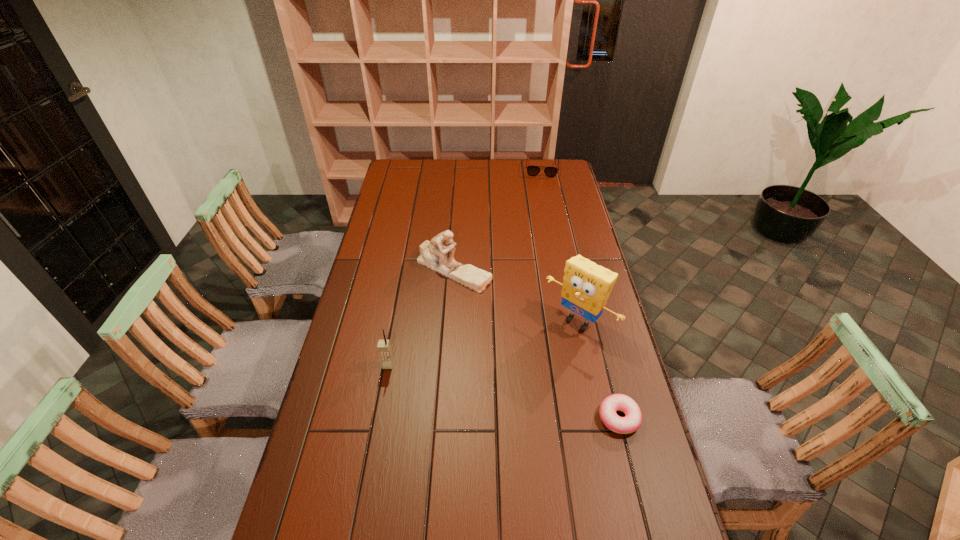
This screenshot has width=960, height=540. Identify the location of free space located on the face of the tallest object. (493, 408).

Locate an element on the screen. object at the far edge is located at coordinates (531, 170).

Identify the location of object that is at the left edge. (384, 347).

This screenshot has width=960, height=540. Find the location of `doughnut located in the right edge section of the desktop`. doughnut located in the right edge section of the desktop is located at coordinates (632, 421).

Identify the location of spectacles present at the right edge. The height and width of the screenshot is (540, 960). (531, 170).

In order to click on sponge located in the right edge section of the desktop in this screenshot , I will do `click(587, 286)`.

This screenshot has height=540, width=960. What are the coordinates of `object that is at the far right corner` in the screenshot? It's located at (531, 170).

Identify the location of free region at the far edge of the desktop. click(x=478, y=159).

Where is `free location at the near edge`? free location at the near edge is located at coordinates (513, 519).

In the image, there is a desktop. Where is `free space at the left edge`? This screenshot has width=960, height=540. free space at the left edge is located at coordinates (410, 192).